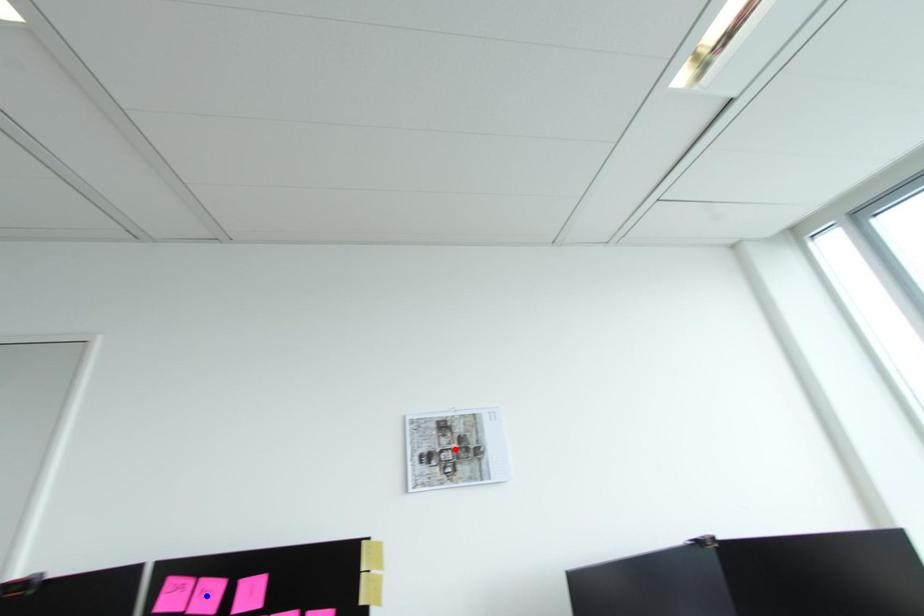
Question: In the image, two points are highlighted. Which point is nearer to the camera? Reply with the corresponding letter.

Choices:
 (A) blue point
 (B) red point

Answer: (A)